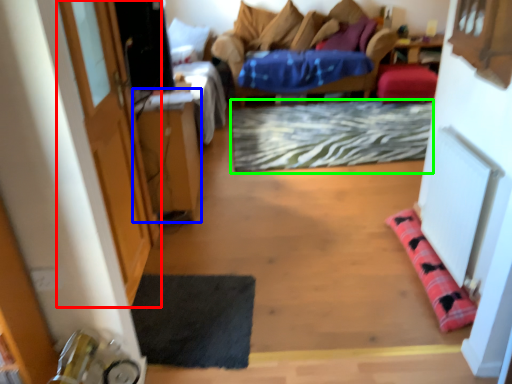
Question: Based on their relative distances, which object is nearer to door (highlighted by a red box)? Choose from table (highlighted by a blue box) and doormat (highlighted by a green box).

Choices:
 (A) table
 (B) doormat

Answer: (A)